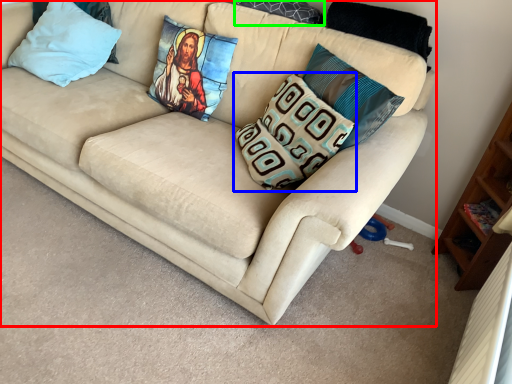
Question: Which object is positioned farthest from studio couch (highlighted by a red box)? Select from pillow (highlighted by a blue box) and pillow (highlighted by a green box).

Choices:
 (A) pillow
 (B) pillow

Answer: (B)